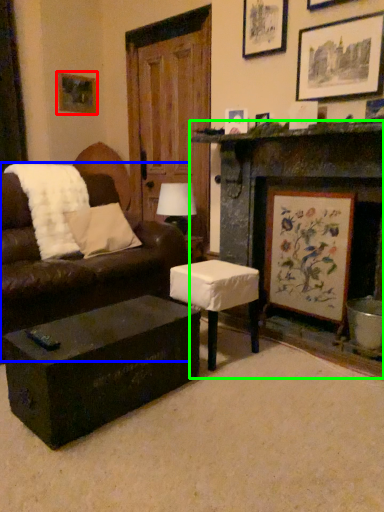
Question: Considering the real-world distances, which object is closest to picture frame (highlighted by a red box)? studio couch (highlighted by a blue box) or fireplace (highlighted by a green box).

Choices:
 (A) studio couch
 (B) fireplace

Answer: (A)